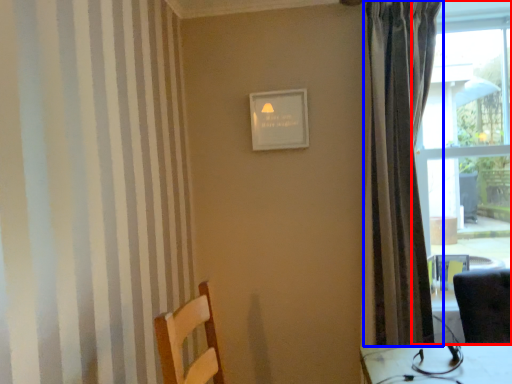
Question: Which of the following is the closest to the observer, window (highlighted by a red box) or curtain (highlighted by a blue box)?

Choices:
 (A) window
 (B) curtain

Answer: (B)